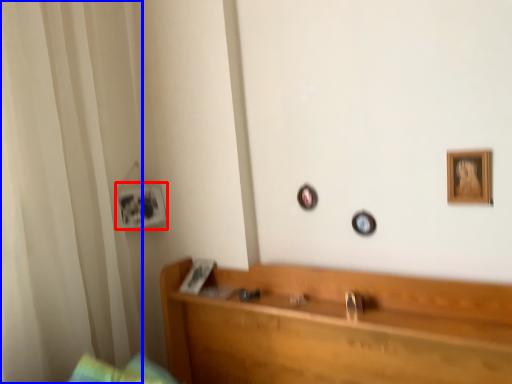
Question: Which point is further to the camera, picture frame (highlighted by a red box) or curtain (highlighted by a blue box)?

Choices:
 (A) picture frame
 (B) curtain

Answer: (A)